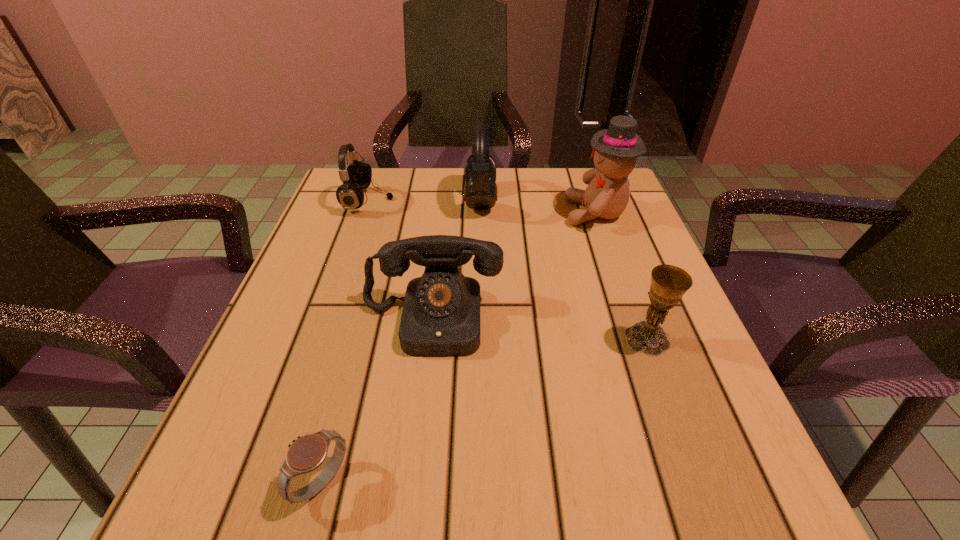
Find the location of a particular element. Image resolution: width=960 pixels, height=540 pixels. free space in the image that satisfies the following two spatial constraints: 1. on the front-facing side of the rag_doll; 2. on the dial of the telephone is located at coordinates (634, 320).

Where is `free location that satisfies the following two spatial constraints: 1. on the earcups of the fifth shortest object; 2. on the back side of the chalice`? This screenshot has height=540, width=960. free location that satisfies the following two spatial constraints: 1. on the earcups of the fifth shortest object; 2. on the back side of the chalice is located at coordinates (481, 339).

This screenshot has height=540, width=960. I want to click on vacant space that satisfies the following two spatial constraints: 1. on the front-facing side of the rag_doll; 2. on the dial of the telephone, so click(x=634, y=320).